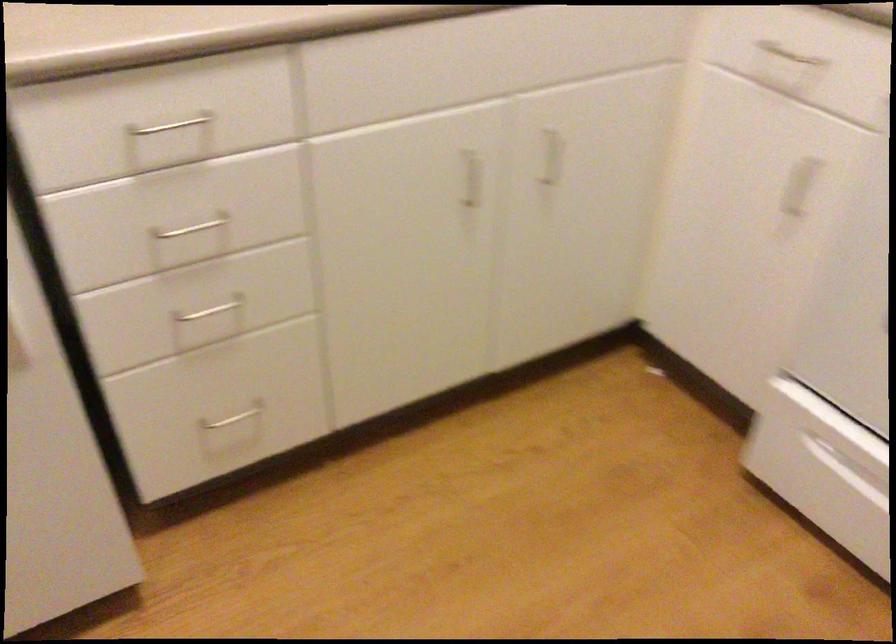
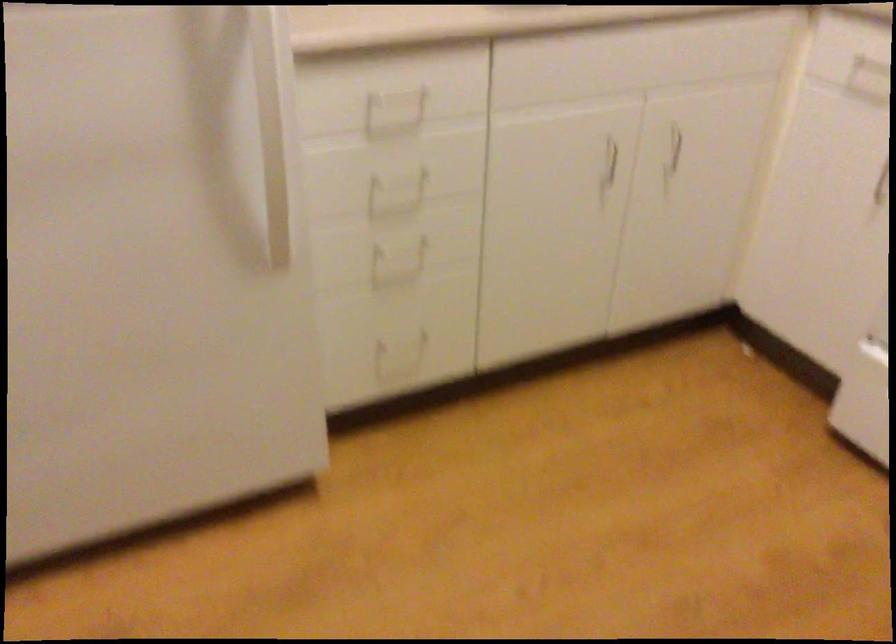
In the second image, find the point that corresponds to point (191, 122) in the first image.

(403, 91)